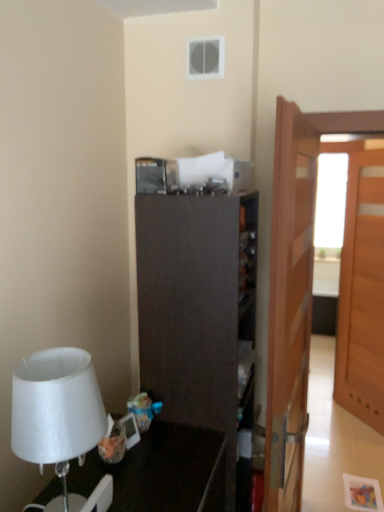
From the picture: Measure the distance between dark wood cabinet at center and camera.

dark wood cabinet at center is 1.25 meters away from camera.

Locate an element on the screen. Image resolution: width=384 pixels, height=512 pixels. light brown wooden door at right, which is counted as the first door, starting from the back is located at coordinates (362, 293).

Describe the element at coordinates (290, 306) in the screenshot. The image size is (384, 512). I see `wooden door at right, which is the second door in right-to-left order` at that location.

The image size is (384, 512). Describe the element at coordinates (60, 420) in the screenshot. I see `white matte lampshade at left` at that location.

The image size is (384, 512). What are the coordinates of `dark wood cabinet at center` in the screenshot? It's located at (200, 315).

Does light brown wooden door at right, arranged as the 1th door when viewed from the right, have a greater width compared to dark wood cabinet at center?

No, light brown wooden door at right, arranged as the 1th door when viewed from the right, is not wider than dark wood cabinet at center.

In the scene shown: Is light brown wooden door at right, the second door positioned from the front, not within dark wood cabinet at center?

light brown wooden door at right, the second door positioned from the front, is positioned outside dark wood cabinet at center.

Does light brown wooden door at right, the 2th door in the left-to-right sequence, turn towards dark wood cabinet at center?

No, light brown wooden door at right, the 2th door in the left-to-right sequence, is not oriented towards dark wood cabinet at center.

Would you consider light brown wooden door at right, the second door positioned from the front, to be distant from dark wood cabinet at center?

Yes, light brown wooden door at right, the second door positioned from the front, and dark wood cabinet at center are quite far apart.

How distant is dark wood cabinet at center from wooden door at right, the 2th door from the back?

dark wood cabinet at center is 11.86 inches from wooden door at right, the 2th door from the back.

Looking at their sizes, would you say dark wood cabinet at center is wider or thinner than wooden door at right, placed as the 1th door when sorted from front to back?

Considering their sizes, dark wood cabinet at center looks broader than wooden door at right, placed as the 1th door when sorted from front to back.

Which is correct: dark wood cabinet at center is inside wooden door at right, placed as the 1th door when sorted from front to back, or outside of it?

dark wood cabinet at center is not inside wooden door at right, placed as the 1th door when sorted from front to back, it's outside.

From the image's perspective, is dark wood cabinet at center beneath wooden door at right, which is the second door in right-to-left order?

Correct, dark wood cabinet at center appears lower than wooden door at right, which is the second door in right-to-left order, in the image.

Does wooden door at right, which is the second door in right-to-left order, turn towards light brown wooden door at right, arranged as the 1th door when viewed from the right?

No, wooden door at right, which is the second door in right-to-left order, is not oriented towards light brown wooden door at right, arranged as the 1th door when viewed from the right.

Which object is thinner, wooden door at right, the first door viewed from the left, or light brown wooden door at right, the 2th door in the left-to-right sequence?

With smaller width is light brown wooden door at right, the 2th door in the left-to-right sequence.

Is point (280, 219) more distant than point (356, 187)?

No, it is in front of (356, 187).

Identify the location of door below the wooden door at right, the 2th door from the back (from a real-world perspective). (362, 293).

Considering the sizes of objects dark wood cabinet at center and white matte lampshade at left in the image provided, who is thinner, dark wood cabinet at center or white matte lampshade at left?

white matte lampshade at left.

Looking at this image, is dark wood cabinet at center surrounding white matte lampshade at left?

Actually, white matte lampshade at left is outside dark wood cabinet at center.

Who is shorter, dark wood cabinet at center or white matte lampshade at left?

Standing shorter between the two is white matte lampshade at left.

Is dark wood cabinet at center directly adjacent to white matte lampshade at left?

No.

Locate an element on the screen. The height and width of the screenshot is (512, 384). door behind the wooden door at right, which is the second door in right-to-left order is located at coordinates (362, 293).

Can you confirm if light brown wooden door at right, the 2th door in the left-to-right sequence, is wider than wooden door at right, the 2th door from the back?

No.

Considering the sizes of light brown wooden door at right, the 2th door in the left-to-right sequence, and wooden door at right, the 2th door from the back, in the image, is light brown wooden door at right, the 2th door in the left-to-right sequence, taller or shorter than wooden door at right, the 2th door from the back,?

light brown wooden door at right, the 2th door in the left-to-right sequence, is taller than wooden door at right, the 2th door from the back.

Is white matte lampshade at left bigger than dark wood cabinet at center?

Incorrect, white matte lampshade at left is not larger than dark wood cabinet at center.

Can dark wood cabinet at center be found inside white matte lampshade at left?

Definitely not — dark wood cabinet at center is not inside white matte lampshade at left.

Is white matte lampshade at left thinner than dark wood cabinet at center?

Correct, the width of white matte lampshade at left is less than that of dark wood cabinet at center.

Would you consider white matte lampshade at left to be distant from dark wood cabinet at center?

Actually, white matte lampshade at left and dark wood cabinet at center are a little close together.

What are the coordinates of `door that is the 1st object located above the white matte lampshade at left (from the image's perspective)` in the screenshot? It's located at (290, 306).

Is the depth of wooden door at right, the 2th door from the back, less than that of white matte lampshade at left?

No, wooden door at right, the 2th door from the back, is behind white matte lampshade at left.

Does wooden door at right, the 2th door from the back, turn towards white matte lampshade at left?

No.

From a real-world perspective, is wooden door at right, the 2th door from the back, physically located above or below white matte lampshade at left?

In terms of real-world spatial position, wooden door at right, the 2th door from the back, is below white matte lampshade at left.

The width and height of the screenshot is (384, 512). Identify the location of door that is the 2nd one when counting rightward from the dark wood cabinet at center. (362, 293).

Where is `door in front of the dark wood cabinet at center`? The height and width of the screenshot is (512, 384). door in front of the dark wood cabinet at center is located at coordinates (290, 306).

Looking at the image, which one is located closer to wooden door at right, the first door viewed from the left, white matte lampshade at left or dark wood cabinet at center?

The object closer to wooden door at right, the first door viewed from the left, is dark wood cabinet at center.

Which object lies further to the anchor point light brown wooden door at right, the second door positioned from the front, dark wood cabinet at center or wooden door at right, placed as the 1th door when sorted from front to back?

The object further to light brown wooden door at right, the second door positioned from the front, is dark wood cabinet at center.

From the image, which object appears to be nearer to white matte lampshade at left, wooden door at right, placed as the 1th door when sorted from front to back, or light brown wooden door at right, which is counted as the first door, starting from the back?

Among the two, wooden door at right, placed as the 1th door when sorted from front to back, is located nearer to white matte lampshade at left.

Based on their spatial positions, is white matte lampshade at left or light brown wooden door at right, the 2th door in the left-to-right sequence, further from dark wood cabinet at center?

light brown wooden door at right, the 2th door in the left-to-right sequence.

When comparing their distances from dark wood cabinet at center, does wooden door at right, placed as the 1th door when sorted from front to back, or white matte lampshade at left seem further?

white matte lampshade at left.

From the image, which object appears to be farther from dark wood cabinet at center, light brown wooden door at right, the second door positioned from the front, or wooden door at right, placed as the 1th door when sorted from front to back?

light brown wooden door at right, the second door positioned from the front, is positioned further to the anchor dark wood cabinet at center.

Estimate the real-world distances between objects in this image. Which object is further from white matte lampshade at left, wooden door at right, which is the second door in right-to-left order, or dark wood cabinet at center?

wooden door at right, which is the second door in right-to-left order.

Looking at the image, which one is located further to white matte lampshade at left, light brown wooden door at right, the second door positioned from the front, or wooden door at right, placed as the 1th door when sorted from front to back?

Answer: Among the two, light brown wooden door at right, the second door positioned from the front, is located further to white matte lampshade at left.

Find the location of a particular element. This screenshot has height=512, width=384. cabinetry between white matte lampshade at left and wooden door at right, the 2th door from the back, in the horizontal direction is located at coordinates (200, 315).

In order to click on door positioned between white matte lampshade at left and light brown wooden door at right, the second door positioned from the front, from near to far in this screenshot , I will do `click(290, 306)`.

The image size is (384, 512). I want to click on cabinetry between white matte lampshade at left and light brown wooden door at right, the 2th door in the left-to-right sequence, from front to back, so click(x=200, y=315).

You are a GUI agent. You are given a task and a screenshot of the screen. Output one action in this format:
    pyautogui.click(x=<x>, y=<y>)
    Task: Click on the cabinetry located between wooden door at right, the first door viewed from the left, and light brown wooden door at right, the 2th door in the left-to-right sequence, in the depth direction
    This screenshot has width=384, height=512.
    Given the screenshot: What is the action you would take?
    pyautogui.click(x=200, y=315)